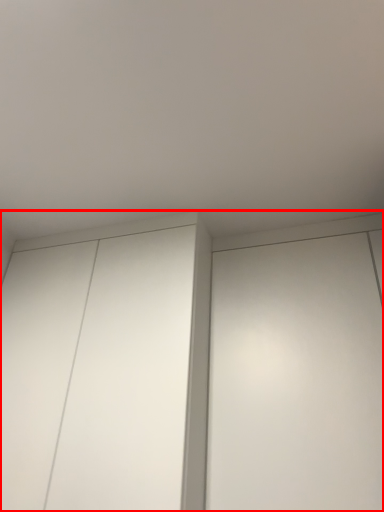
Question: From the image, what is the correct spatial relationship of cupboard (annotated by the red box) in relation to elevator?

Choices:
 (A) right
 (B) left

Answer: (B)